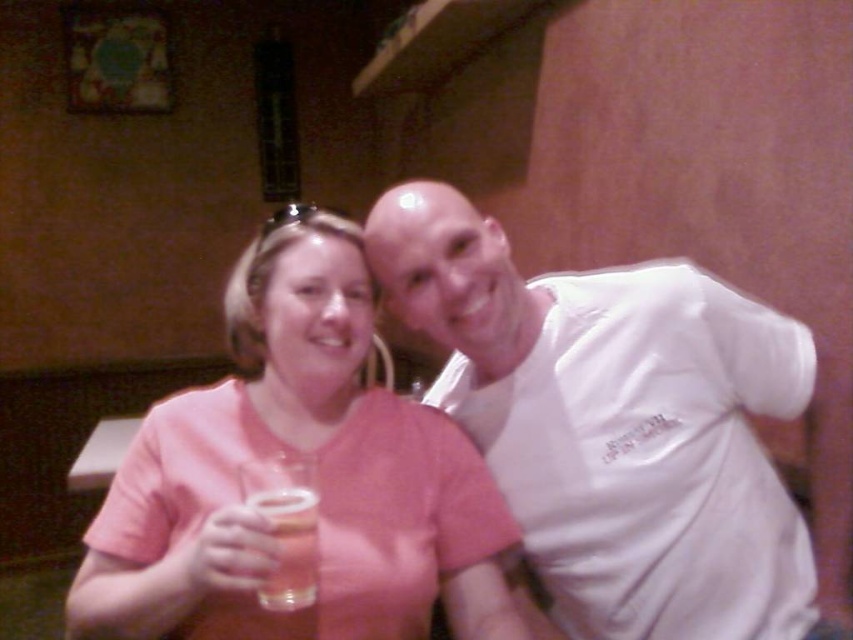
Question: Does pink matte shirt at center appear under translucent glass beer at center?

Choices:
 (A) no
 (B) yes

Answer: (A)

Question: Can you confirm if white cotton shirt at upper right is bigger than pink matte shirt at center?

Choices:
 (A) yes
 (B) no

Answer: (B)

Question: Which is nearer to the pink matte shirt at center?

Choices:
 (A) white cotton shirt at upper right
 (B) translucent glass beer at center

Answer: (B)

Question: Does pink matte shirt at center appear under translucent glass beer at center?

Choices:
 (A) no
 (B) yes

Answer: (A)

Question: Considering the real-world distances, which object is closest to the white cotton shirt at upper right?

Choices:
 (A) pink matte shirt at center
 (B) translucent glass beer at center

Answer: (A)

Question: Which is nearer to the pink matte shirt at center?

Choices:
 (A) white cotton shirt at upper right
 (B) translucent glass beer at center

Answer: (B)